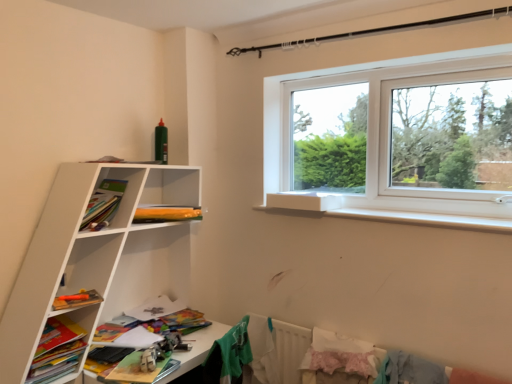
Question: From the image's perspective, is matte orange pencil case at upper left, which is the 1th book from back to front, under green fabric shirt at lower center, which is the first clothing from left to right?

Choices:
 (A) no
 (B) yes

Answer: (A)

Question: Would you say green fabric shirt at lower center, which ranks as the third clothing in right-to-left order, is part of matte orange pencil case at upper left, which is the 1th book from back to front,'s contents?

Choices:
 (A) no
 (B) yes

Answer: (A)

Question: Considering the relative sizes of matte orange pencil case at upper left, which is the 1th book from back to front, and green fabric shirt at lower center, which is the first clothing from left to right, in the image provided, is matte orange pencil case at upper left, which is the 1th book from back to front, thinner than green fabric shirt at lower center, which is the first clothing from left to right,?

Choices:
 (A) yes
 (B) no

Answer: (B)

Question: From the image's perspective, is matte orange pencil case at upper left, the 2th book in the bottom-to-top sequence, on green fabric shirt at lower center, which ranks as the third clothing in right-to-left order?

Choices:
 (A) no
 (B) yes

Answer: (B)

Question: Can you confirm if matte orange pencil case at upper left, which is the 1th book from back to front, is taller than green fabric shirt at lower center, which ranks as the third clothing in right-to-left order?

Choices:
 (A) no
 (B) yes

Answer: (A)

Question: Is point (398, 354) closer or farther from the camera than point (56, 307)?

Choices:
 (A) closer
 (B) farther

Answer: (B)

Question: Is light blue fabric at lower right, which ranks as the first clothing in right-to-left order, situated inside orange matte book at lower left, the first book from the bottom, or outside?

Choices:
 (A) outside
 (B) inside

Answer: (A)

Question: Considering the positions of light blue fabric at lower right, which ranks as the first clothing in right-to-left order, and orange matte book at lower left, marked as the 1th book in a left-to-right arrangement, in the image, is light blue fabric at lower right, which ranks as the first clothing in right-to-left order, wider or thinner than orange matte book at lower left, marked as the 1th book in a left-to-right arrangement,?

Choices:
 (A) wide
 (B) thin

Answer: (A)

Question: In terms of size, does light blue fabric at lower right, marked as the third clothing in a left-to-right arrangement, appear bigger or smaller than orange matte book at lower left, which appears as the 2th book when viewed from the right?

Choices:
 (A) big
 (B) small

Answer: (A)

Question: Considering the positions of matte orange pencil case at upper left, which is the 2th book in front-to-back order, and wooden toy car at lower left in the image, is matte orange pencil case at upper left, which is the 2th book in front-to-back order, taller or shorter than wooden toy car at lower left?

Choices:
 (A) tall
 (B) short

Answer: (B)

Question: Is point (174, 210) closer or farther from the camera than point (205, 337)?

Choices:
 (A) farther
 (B) closer

Answer: (B)

Question: Choose the correct answer: Is matte orange pencil case at upper left, the 1th book from the top, inside wooden toy car at lower left or outside it?

Choices:
 (A) inside
 (B) outside

Answer: (B)

Question: From the image's perspective, relative to wooden toy car at lower left, is matte orange pencil case at upper left, the 1th book from the top, above or below?

Choices:
 (A) below
 (B) above

Answer: (B)

Question: Is light blue fabric at lower right, marked as the third clothing in a left-to-right arrangement, wider or thinner than black metal clothesline at upper center?

Choices:
 (A) thin
 (B) wide

Answer: (B)

Question: In terms of size, does light blue fabric at lower right, which ranks as the first clothing in right-to-left order, appear bigger or smaller than black metal clothesline at upper center?

Choices:
 (A) big
 (B) small

Answer: (B)